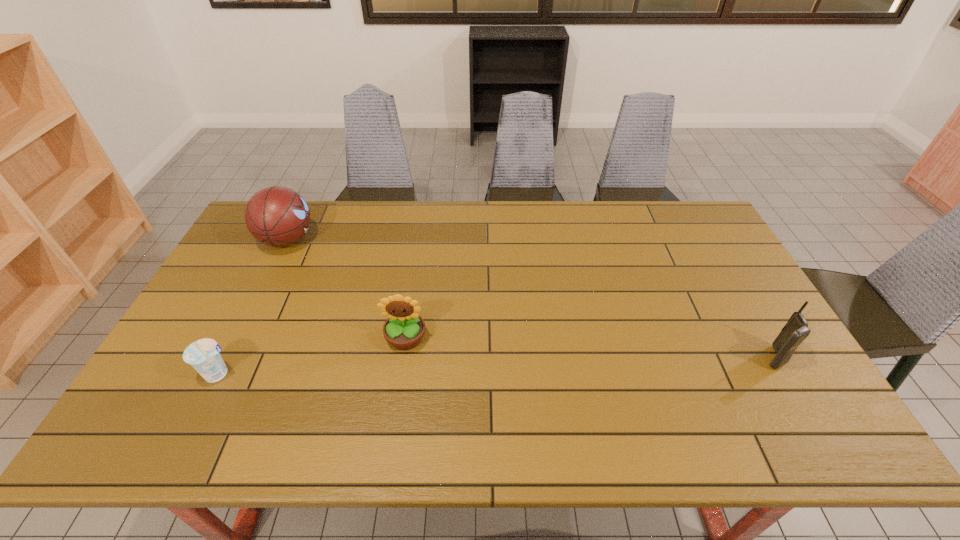
Identify the location of object that is at the far edge. (276, 216).

The image size is (960, 540). What are the coordinates of `basketball that is at the left edge` in the screenshot? It's located at (276, 216).

The image size is (960, 540). I want to click on yogurt present at the left edge, so click(x=203, y=355).

Image resolution: width=960 pixels, height=540 pixels. What are the coordinates of `object located in the right edge section of the desktop` in the screenshot? It's located at (796, 330).

Where is `object at the far left corner`? The width and height of the screenshot is (960, 540). object at the far left corner is located at coordinates (276, 216).

This screenshot has width=960, height=540. I want to click on vacant area at the far edge of the desktop, so click(x=425, y=200).

You are a GUI agent. You are given a task and a screenshot of the screen. Output one action in this format:
    pyautogui.click(x=<x>, y=<y>)
    Task: Click on the blank area at the near edge
    This screenshot has width=960, height=540.
    Given the screenshot: What is the action you would take?
    pyautogui.click(x=685, y=433)

Image resolution: width=960 pixels, height=540 pixels. I want to click on blank area at the left edge, so click(x=254, y=255).

Where is `vacant space at the right edge of the desktop`? This screenshot has height=540, width=960. vacant space at the right edge of the desktop is located at coordinates (810, 387).

Image resolution: width=960 pixels, height=540 pixels. What are the coordinates of `empty location between the yogurt and the basketball` in the screenshot? It's located at (253, 307).